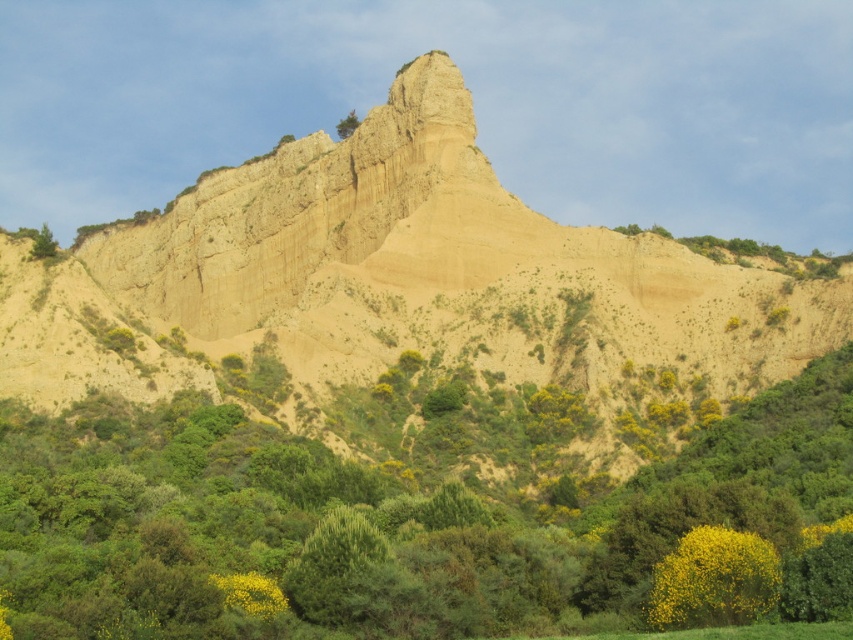
You are a hiker planning to take a photo of the cliff. You want to include both the green leafy tree at upper left and the green leafy tree at upper center in your frame. Which tree should you focus on to ensure both are visible without zooming in too much?

You should focus on the green leafy tree at upper left because it is wider than the green leafy tree at upper center, so keeping it in frame will likely accommodate the smaller tree as well.

You are a hiker standing at the base of the earthy sandstone cliff at center and the green leafy shrub at center. Which object is positioned to the left when facing the cliff?

The earthy sandstone cliff at center is to the left of the green leafy shrub at center, so when facing the cliff, the earthy sandstone cliff at center is on your left side.

You are a hiker standing at the base of the cliff. You notice two points marked on the cliff face. The first point is labeled as point (514, 289) and the second as point (88, 561). Which point is closer to you?

Point (88, 561) is closer to you because it is in front of point (514, 289).